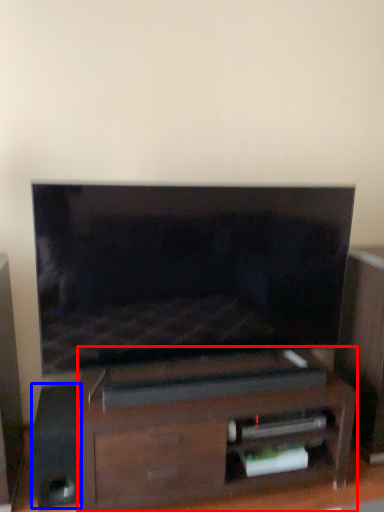
Question: Among these objects, which one is farthest to the camera, furniture (highlighted by a red box) or speaker (highlighted by a blue box)?

Choices:
 (A) furniture
 (B) speaker

Answer: (B)